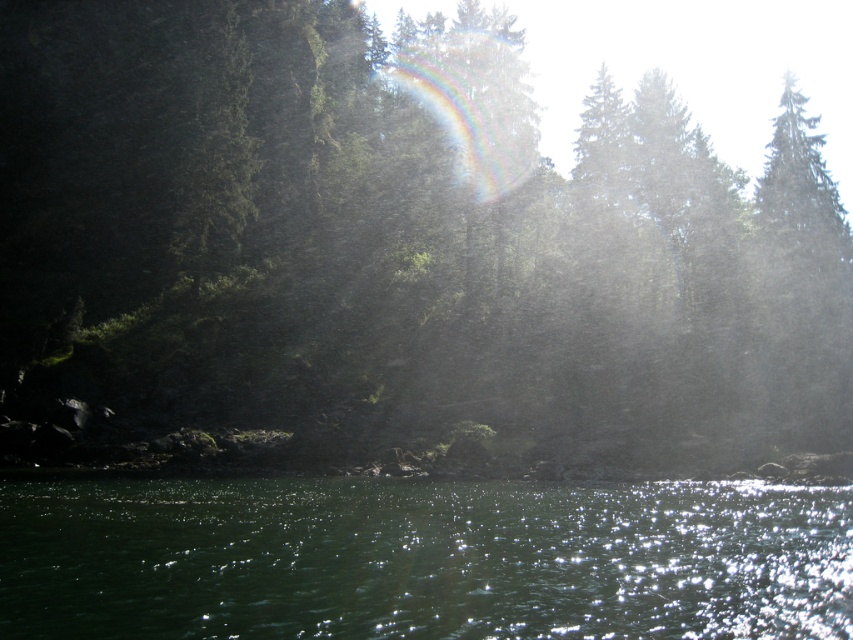
You are a hiker trying to cross the green liquid at lower center. There is a green matte tree at center nearby. Which direction should you walk to reach the tree from the liquid?

The green matte tree at center is positioned on the left side of green liquid at lower center, so you should walk to the left to reach the tree from the liquid.